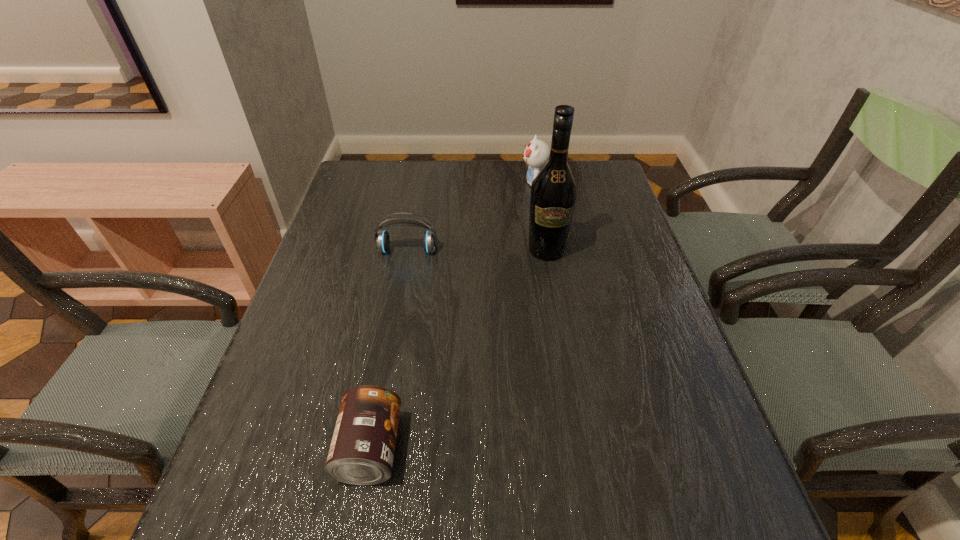
This screenshot has height=540, width=960. I want to click on vacant point located on the front label of the can, so click(x=444, y=449).

Locate an element on the screen. object situated at the far edge is located at coordinates (536, 153).

At what (x,y) coordinates should I click in order to perform the action: click on object that is at the left edge. Please return your answer as a coordinate pair (x, y). This screenshot has height=540, width=960. Looking at the image, I should click on coord(382,241).

Image resolution: width=960 pixels, height=540 pixels. In order to click on free space at the far edge in this screenshot , I will do `click(431, 160)`.

The image size is (960, 540). I want to click on free space at the left edge of the desktop, so click(326, 315).

Find the location of `vacant region at the right edge of the desktop`. vacant region at the right edge of the desktop is located at coordinates (666, 463).

You are a GUI agent. You are given a task and a screenshot of the screen. Output one action in this format:
    pyautogui.click(x=<x>, y=<y>)
    Task: Click on the vacant space at the far left corner of the desktop
    
    Given the screenshot: What is the action you would take?
    pyautogui.click(x=362, y=172)

This screenshot has width=960, height=540. Find the location of `free location at the near left corner of the desktop`. free location at the near left corner of the desktop is located at coordinates coord(258,521).

What are the coordinates of `free region at the far right corner` in the screenshot? It's located at (569, 165).

I want to click on vacant space in between the headset and the can, so click(389, 349).